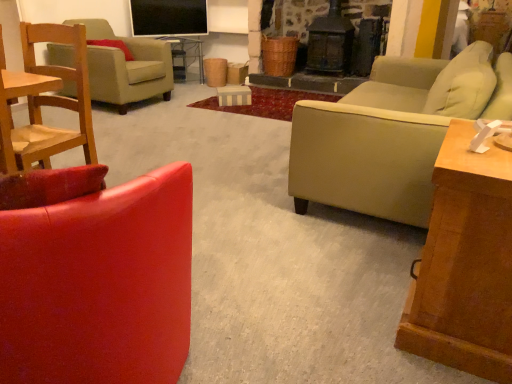
Question: From the image's perspective, is wooden side table at right under matte wood side table at center?

Choices:
 (A) yes
 (B) no

Answer: (A)

Question: From the image's perspective, is wooden side table at right on matte wood side table at center?

Choices:
 (A) no
 (B) yes

Answer: (A)

Question: Is wooden side table at right positioned with its back to matte wood side table at center?

Choices:
 (A) no
 (B) yes

Answer: (A)

Question: Does wooden side table at right have a lesser width compared to matte wood side table at center?

Choices:
 (A) no
 (B) yes

Answer: (B)

Question: Can you confirm if wooden side table at right is bigger than matte wood side table at center?

Choices:
 (A) yes
 (B) no

Answer: (A)

Question: Is wooden side table at right wider than matte wood side table at center?

Choices:
 (A) yes
 (B) no

Answer: (B)

Question: Does beige leather couch at right come behind matte red leather chair at left, which is counted as the 1th chair, starting from the front?

Choices:
 (A) no
 (B) yes

Answer: (B)

Question: Considering the relative sizes of beige leather couch at right and matte red leather chair at left, the 3th chair in the top-to-bottom sequence, in the image provided, is beige leather couch at right thinner than matte red leather chair at left, the 3th chair in the top-to-bottom sequence,?

Choices:
 (A) no
 (B) yes

Answer: (A)

Question: Considering the relative sizes of beige leather couch at right and matte red leather chair at left, the 3th chair in the top-to-bottom sequence, in the image provided, is beige leather couch at right shorter than matte red leather chair at left, the 3th chair in the top-to-bottom sequence,?

Choices:
 (A) no
 (B) yes

Answer: (B)

Question: From the image's perspective, is beige leather couch at right below matte red leather chair at left, the 3th chair in the top-to-bottom sequence?

Choices:
 (A) no
 (B) yes

Answer: (A)

Question: Is beige leather couch at right aimed at matte red leather chair at left, arranged as the 3th chair when viewed from the back?

Choices:
 (A) no
 (B) yes

Answer: (A)

Question: From the image's perspective, is beige leather couch at right on matte red leather chair at left, the 1th chair from the bottom?

Choices:
 (A) yes
 (B) no

Answer: (A)

Question: Would you say suede-like beige pillow at upper left is part of matte red leather chair at left, the 3th chair in the top-to-bottom sequence,'s contents?

Choices:
 (A) yes
 (B) no

Answer: (B)